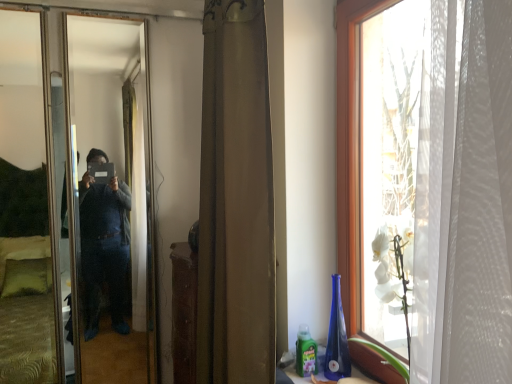
Question: Based on their positions, is brown fabric curtain at center located to the left or right of metallic reflective mirror at left?

Choices:
 (A) left
 (B) right

Answer: (B)

Question: From a real-world perspective, is brown fabric curtain at center physically located above or below metallic reflective mirror at left?

Choices:
 (A) below
 (B) above

Answer: (B)

Question: Considering the positions of point (238, 314) and point (82, 278), is point (238, 314) closer or farther from the camera than point (82, 278)?

Choices:
 (A) farther
 (B) closer

Answer: (B)

Question: In terms of width, does metallic reflective mirror at left look wider or thinner when compared to brown fabric curtain at center?

Choices:
 (A) thin
 (B) wide

Answer: (A)

Question: Choose the correct answer: Is metallic reflective mirror at left inside brown fabric curtain at center or outside it?

Choices:
 (A) outside
 (B) inside

Answer: (A)

Question: Is metallic reflective mirror at left in front of or behind brown fabric curtain at center in the image?

Choices:
 (A) behind
 (B) front

Answer: (A)

Question: Considering the positions of point (134, 74) and point (220, 345), is point (134, 74) closer or farther from the camera than point (220, 345)?

Choices:
 (A) farther
 (B) closer

Answer: (A)